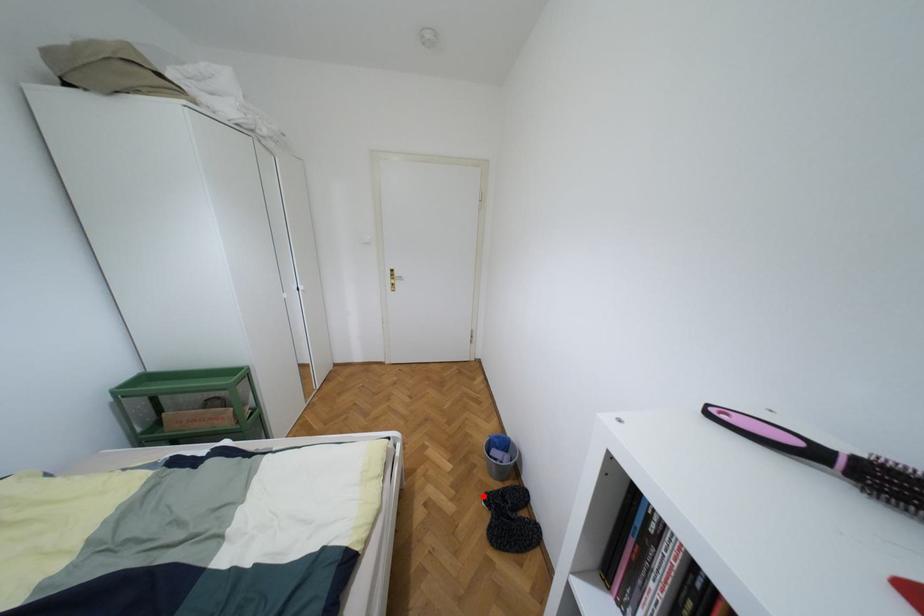
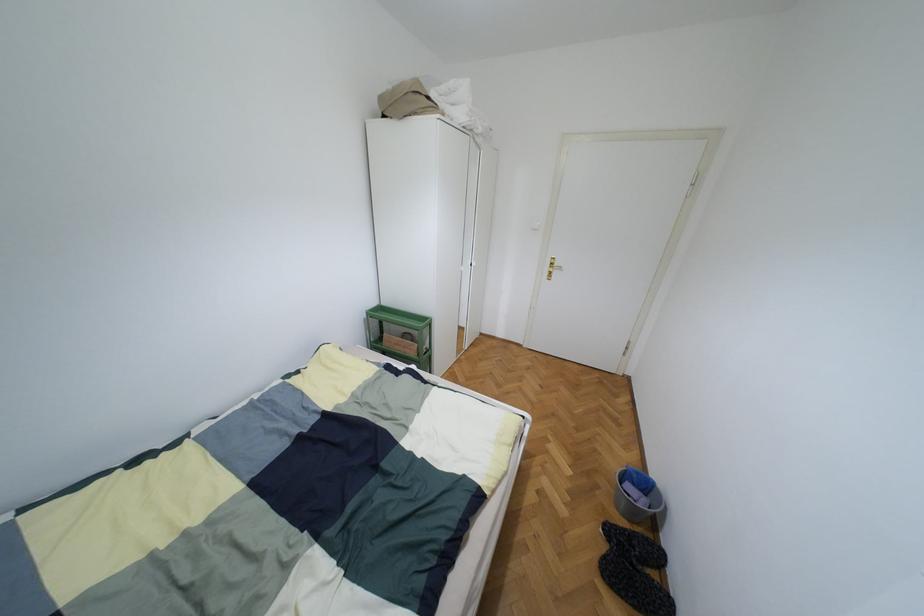
Where in the second image is the point corresponding to the highlighted location from the first image?

(603, 524)